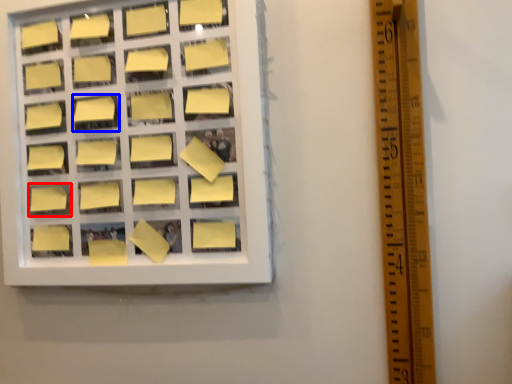
Question: Which of the following is the farthest to the observer, square (highlighted by a red box) or square (highlighted by a blue box)?

Choices:
 (A) square
 (B) square

Answer: (A)